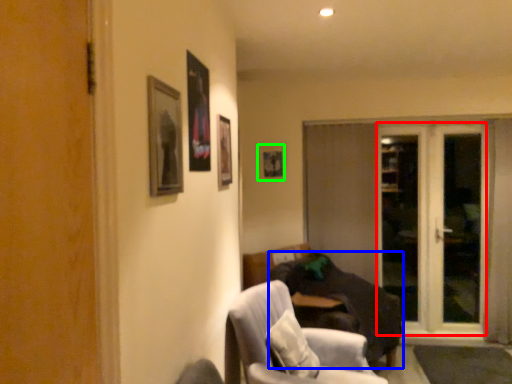
Question: Estimate the real-world distances between objects in this image. Which object is closer to screen door (highlighted by a red box), studio couch (highlighted by a blue box) or picture frame (highlighted by a green box)?

Choices:
 (A) studio couch
 (B) picture frame

Answer: (A)